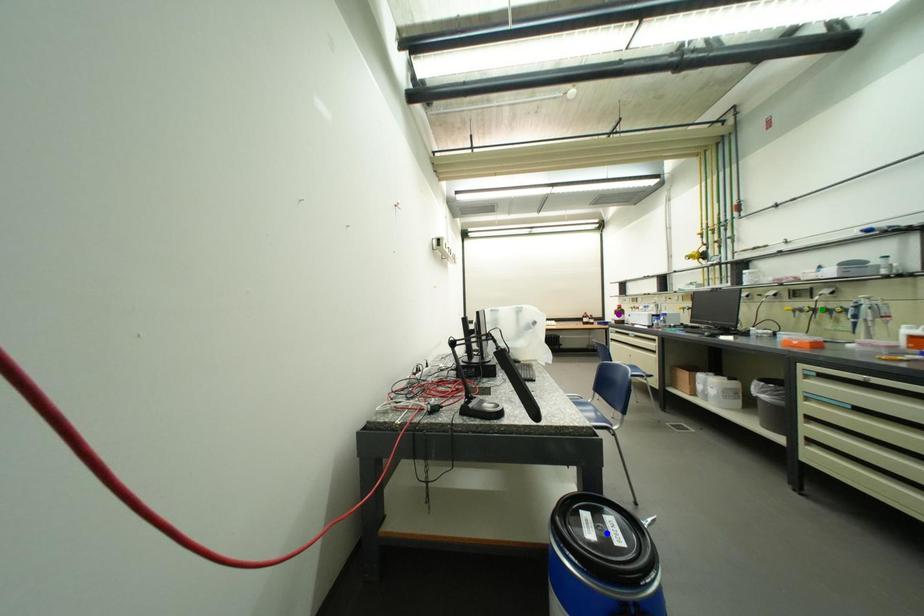
Order these from nearest to farthest:
green point
purple point
blue point

blue point
green point
purple point